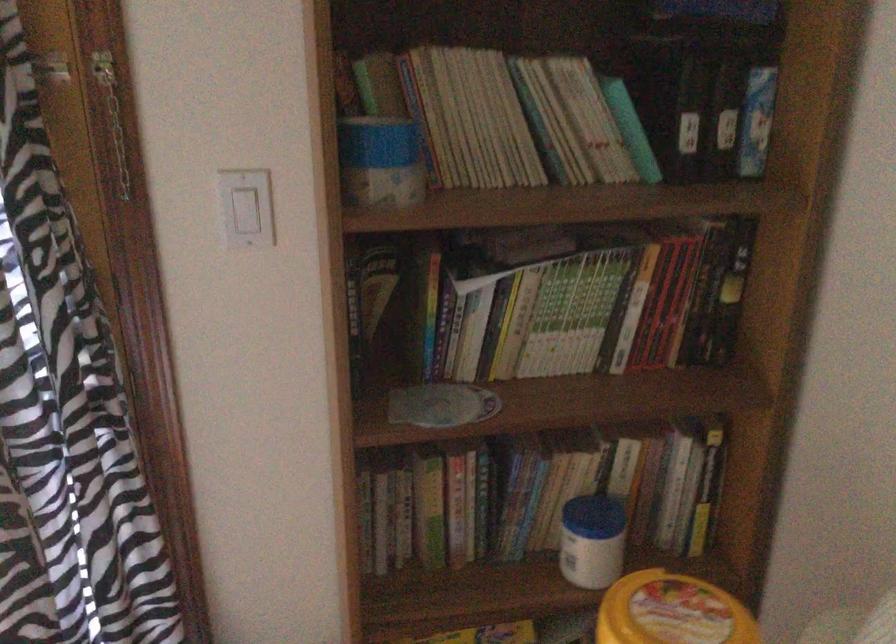
I want to click on white light switch, so click(x=246, y=207).